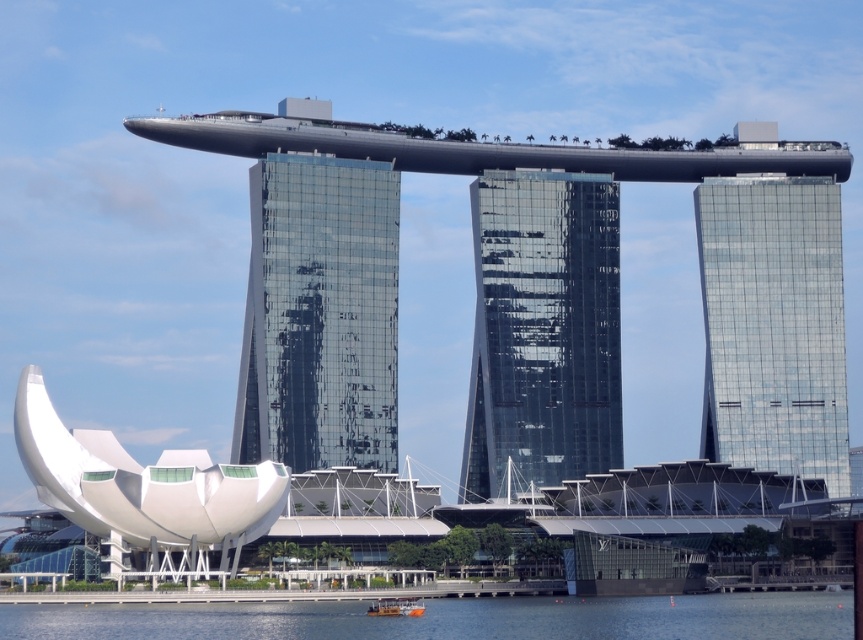
You are standing at the entrance of the transparent glass building at center and want to walk to the transparent glass skyscraper at right. Which direction should you face to see both structures clearly?

You should face away from the transparent glass skyscraper at right because the transparent glass building at center is in front of it, so facing away would allow you to see both structures without obstruction.

You are standing in front of the Marina Bay Sands hotel and want to take a photo that includes both the point at coordinates point (x=294, y=378) and point (x=316, y=625). Which point should you focus on first to ensure both are in focus?

You should focus on point (x=294, y=378) first because it is closer to you than point (x=316, y=625), ensuring both points are within the depth of field.

In the scene shown: You are standing at the base of the transparent glass building at center. A drone is flying towards you from the direction of the Marina Bay Sands hotel. The drone has a maximum flight range of 400 meters. Will the drone be able to reach you before running out of battery?

The transparent glass building at center is 402.12 meters away from the viewer. Since the drone can only fly 400 meters, it will not be able to reach you before running out of battery.